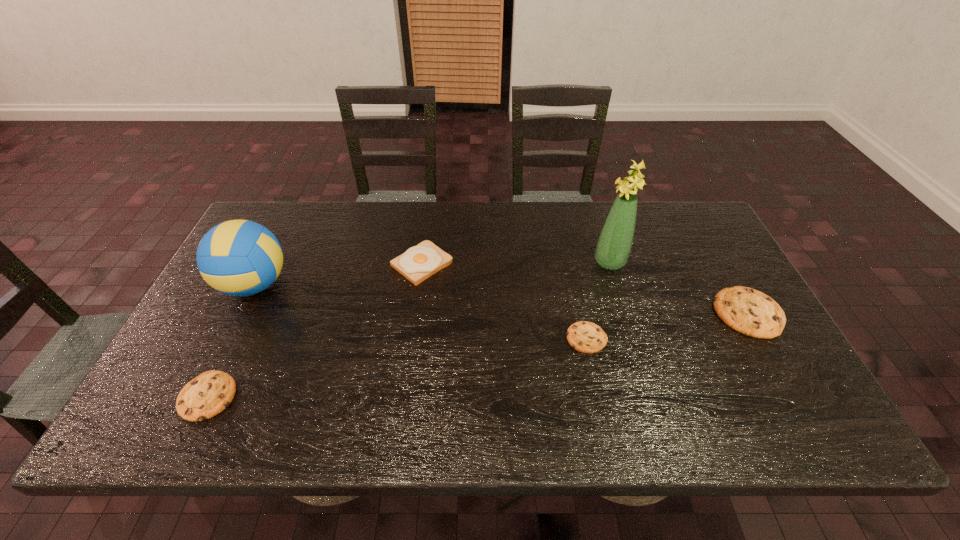
Identify the location of empty space that is in between the rightmost object and the fifth shortest object. The width and height of the screenshot is (960, 540). (501, 299).

Locate an element on the screen. free spot between the leftmost cookie and the fourth object from right to left is located at coordinates (315, 330).

Find the location of a particular element. free space that is in between the fourth tallest object and the second tallest object is located at coordinates (501, 299).

I want to click on free point between the rightmost cookie and the volleyball, so click(501, 299).

You are a GUI agent. You are given a task and a screenshot of the screen. Output one action in this format:
    pyautogui.click(x=<x>, y=<y>)
    Task: Click on the unoccupied area between the fourth object from right to left and the volleyball
    
    Given the screenshot: What is the action you would take?
    pyautogui.click(x=338, y=274)

Locate an element on the screen. This screenshot has height=540, width=960. empty location between the second shortest object and the fourth object from right to left is located at coordinates [315, 330].

Locate which object ranks fourth in proximity to the toast. Please provide its 2D coordinates. Your answer should be formatted as a tuple, i.e. [(x, y)], where the tuple contains the x and y coordinates of a point satisfying the conditions above.

[(614, 245)]

Image resolution: width=960 pixels, height=540 pixels. What are the coordinates of `object that can be found as the second closest to the shortest cookie` in the screenshot? It's located at (748, 311).

Select which cookie appears as the closest to the second object from right to left. Please provide its 2D coordinates. Your answer should be formatted as a tuple, i.e. [(x, y)], where the tuple contains the x and y coordinates of a point satisfying the conditions above.

[(586, 337)]

You are a GUI agent. You are given a task and a screenshot of the screen. Output one action in this format:
    pyautogui.click(x=<x>, y=<y>)
    Task: Click on the cookie that can be found as the second closest to the volleyball
    
    Given the screenshot: What is the action you would take?
    pyautogui.click(x=586, y=337)